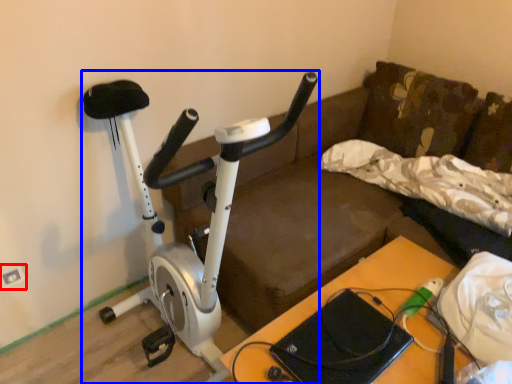
Question: Among these objects, which one is nearest to the camera, electric outlet (highlighted by a red box) or stationary bicycle (highlighted by a blue box)?

Choices:
 (A) electric outlet
 (B) stationary bicycle

Answer: (B)